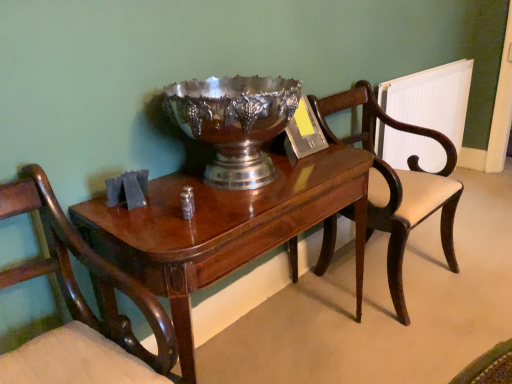
At what (x,y) coordinates should I click in order to perform the action: click on free location in front of mahogany wood chair at right, the 1th chair from the back. Please return your answer as a coordinate pair (x, y). This screenshot has height=384, width=512. Looking at the image, I should click on (424, 342).